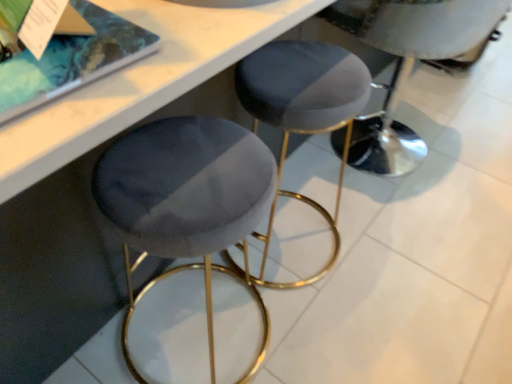
You are a GUI agent. You are given a task and a screenshot of the screen. Output one action in this format:
    pyautogui.click(x=<x>, y=<y>)
    Task: Click on the vacant space behind velvet grey stool at center
    The height and width of the screenshot is (384, 512).
    Given the screenshot: What is the action you would take?
    pyautogui.click(x=415, y=96)